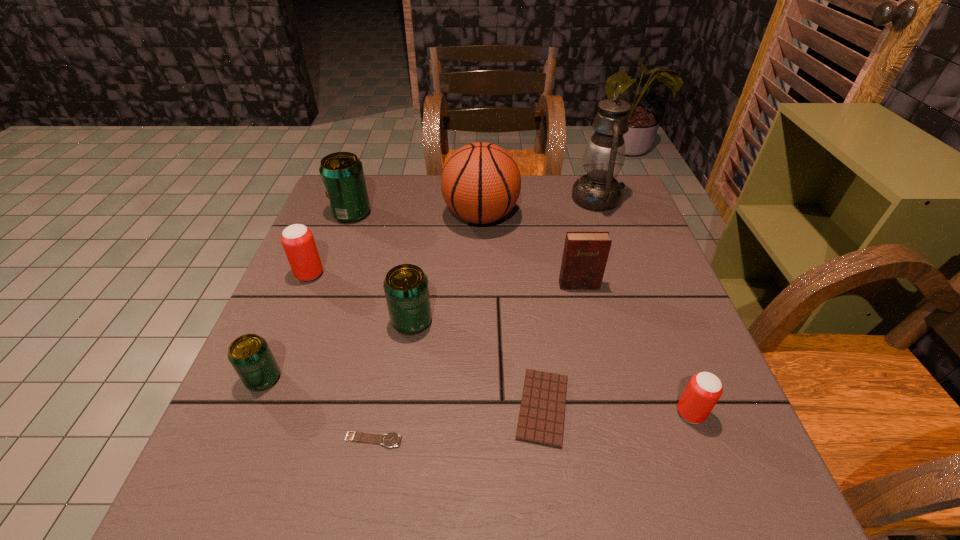
Image resolution: width=960 pixels, height=540 pixels. I want to click on unoccupied position between the chocolate bar and the oil lamp, so click(569, 303).

You are a GUI agent. You are given a task and a screenshot of the screen. Output one action in this format:
    pyautogui.click(x=<x>, y=<y>)
    Task: Click on the object identified as the second closest to the oil lamp
    
    Given the screenshot: What is the action you would take?
    pyautogui.click(x=585, y=254)

This screenshot has height=540, width=960. I want to click on the third closest object to the orange basketball, so click(342, 175).

Locate which beer can is the closest to the brown chocolate bar. Please provide its 2D coordinates. Your answer should be formatted as a tuple, i.e. [(x, y)], where the tuple contains the x and y coordinates of a point satisfying the conditions above.

[(406, 288)]

Identify which beer can is the second closest to the biggest green beer can. Please provide its 2D coordinates. Your answer should be formatted as a tuple, i.e. [(x, y)], where the tuple contains the x and y coordinates of a point satisfying the conditions above.

[(406, 288)]

Locate which green beer can ranks in proximity to the smallest green beer can. Please provide its 2D coordinates. Your answer should be formatted as a tuple, i.e. [(x, y)], where the tuple contains the x and y coordinates of a point satisfying the conditions above.

[(406, 288)]

Point out which green beer can is positioned as the nearest to the reddish-brown diary. Please provide its 2D coordinates. Your answer should be formatted as a tuple, i.e. [(x, y)], where the tuple contains the x and y coordinates of a point satisfying the conditions above.

[(406, 288)]

Image resolution: width=960 pixels, height=540 pixels. I want to click on vacant area that satisfies the following two spatial constraints: 1. on the front side of the second farthest beer can; 2. on the right side of the second shortest object, so click(254, 407).

At what (x,y) coordinates should I click in order to perform the action: click on free space that satisfies the following two spatial constraints: 1. on the side where the inflation valve is located; 2. on the left side of the ninth tallest object. Please return your answer as a coordinate pair (x, y). The width and height of the screenshot is (960, 540). Looking at the image, I should click on (481, 407).